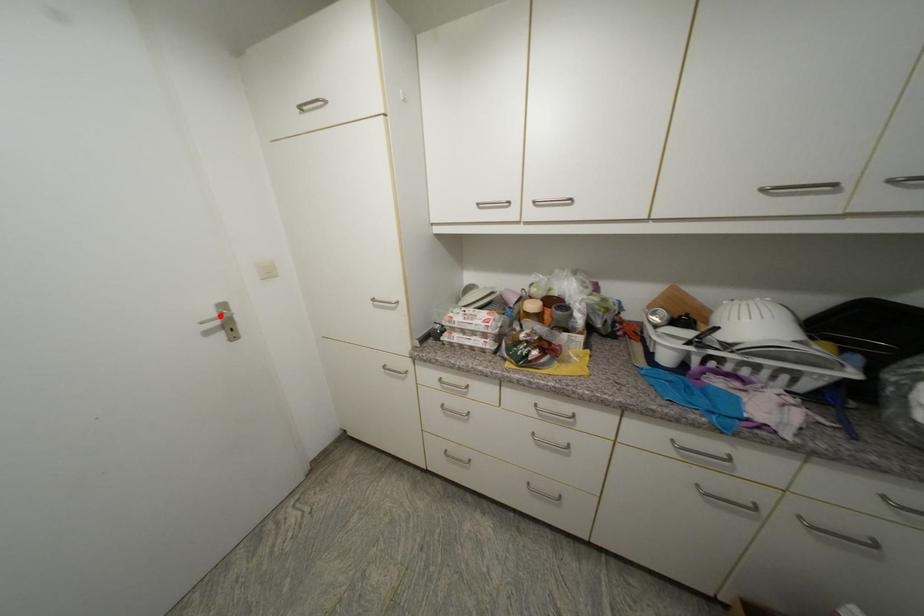
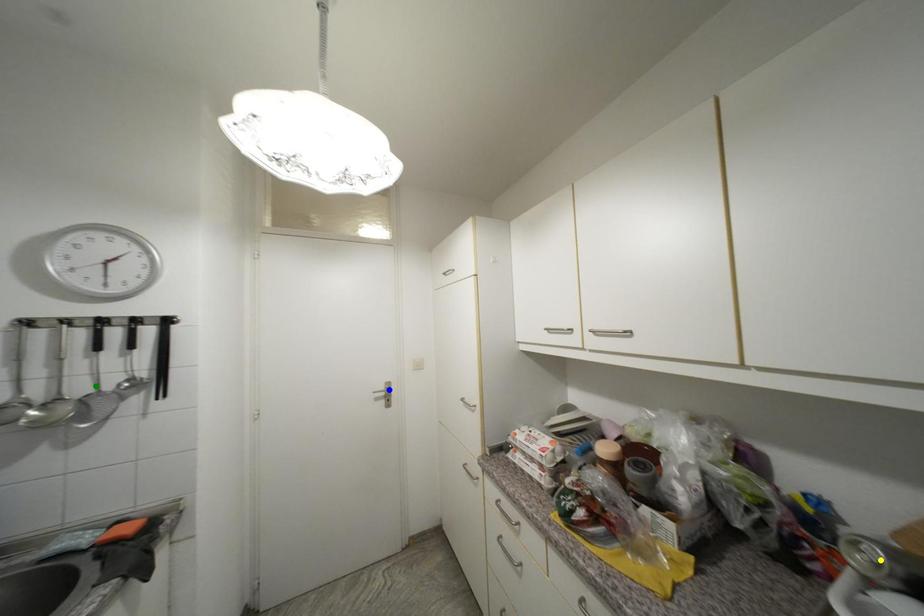
Question: I am providing you with two images of the same scene from different viewpoints. A red point is marked on the first image. You are given multiple points on the second image. Which point in image 2 represents the same 3d spot as the red point in image 1?

Choices:
 (A) green point
 (B) yellow point
 (C) blue point

Answer: (C)